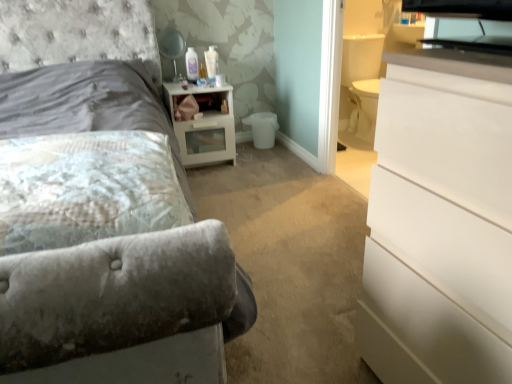
Question: Should I look upward or downward to see velvet gray bed at upper left?

Choices:
 (A) down
 (B) up

Answer: (B)

Question: From the image's perspective, is velvet gray bed at upper left below matte black lampshade at upper center?

Choices:
 (A) no
 (B) yes

Answer: (B)

Question: Is velvet gray bed at upper left positioned in front of matte black lampshade at upper center?

Choices:
 (A) no
 (B) yes

Answer: (B)

Question: Does velvet gray bed at upper left turn towards matte black lampshade at upper center?

Choices:
 (A) yes
 (B) no

Answer: (B)

Question: Can you confirm if velvet gray bed at upper left is thinner than matte black lampshade at upper center?

Choices:
 (A) yes
 (B) no

Answer: (B)

Question: From a real-world perspective, does velvet gray bed at upper left stand above matte black lampshade at upper center?

Choices:
 (A) no
 (B) yes

Answer: (A)

Question: Is velvet gray bed at upper left at the right side of matte black lampshade at upper center?

Choices:
 (A) no
 (B) yes

Answer: (A)

Question: From the image's perspective, does fluffy white pillow at left appear higher than white glossy chest of drawers at right?

Choices:
 (A) yes
 (B) no

Answer: (A)

Question: Is fluffy white pillow at left surrounding white glossy chest of drawers at right?

Choices:
 (A) yes
 (B) no

Answer: (B)

Question: Can you confirm if fluffy white pillow at left is taller than white glossy chest of drawers at right?

Choices:
 (A) no
 (B) yes

Answer: (A)

Question: Does fluffy white pillow at left have a greater width compared to white glossy chest of drawers at right?

Choices:
 (A) no
 (B) yes

Answer: (B)

Question: From a real-world perspective, does fluffy white pillow at left stand above white glossy chest of drawers at right?

Choices:
 (A) yes
 (B) no

Answer: (A)

Question: Is fluffy white pillow at left next to white glossy chest of drawers at right?

Choices:
 (A) no
 (B) yes

Answer: (A)

Question: Is fluffy white pillow at left not inside matte black lampshade at upper center?

Choices:
 (A) yes
 (B) no

Answer: (A)